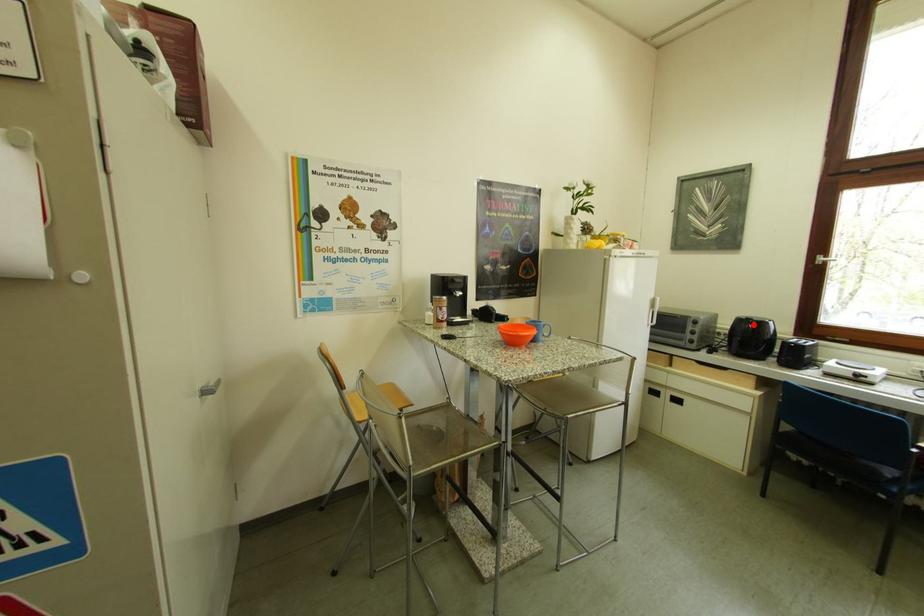
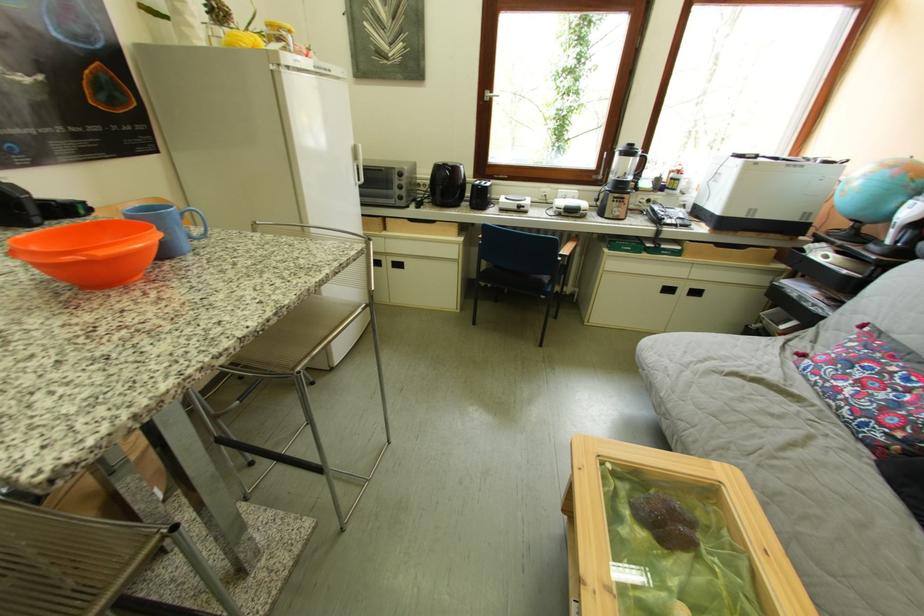
Question: I am providing you with two images of the same scene from different viewpoints. In image1, a red point is highlighted. Considering the same 3D point in image2, which of the following is correct?

Choices:
 (A) It is closer
 (B) It is farther

Answer: (A)